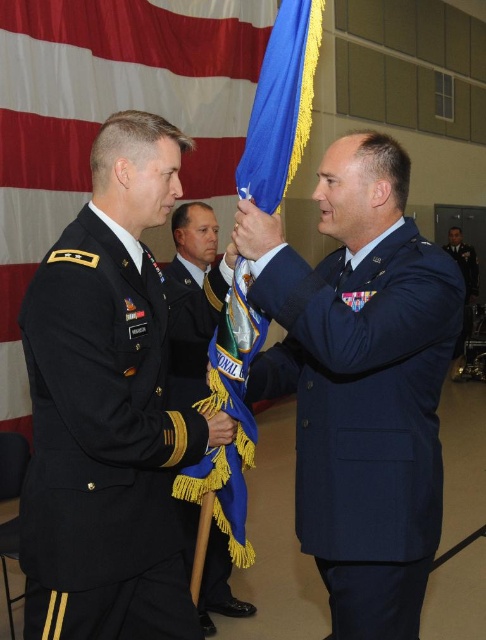
You are standing at the back of the military ceremony hall. You see two points marked in the image. Which point is closer to you, point [145,371] or point [465,332]?

Point [465,332] is further away from you, so point [145,371] is closer to you.

You are a photographer positioned at the center of the room. You need to take a photo that includes both the black matte uniform at left and the blue fabric uniform at right. Given that your camera has a maximum zoom range of 5 meters, will you be able to capture both subjects in a single frame without moving closer?

The distance between the black matte uniform at left and the blue fabric uniform at right is 6.43 meters. Since the camera can only zoom up to 5 meters, you will not be able to capture both subjects in a single frame without moving closer.

You are an observer standing in the front row of the ceremony. You notice a specific point marked at coordinates point (364,416). Which object in the scene does this point belong to?

The point (364,416) is on the navy blue fabric uniform at center.